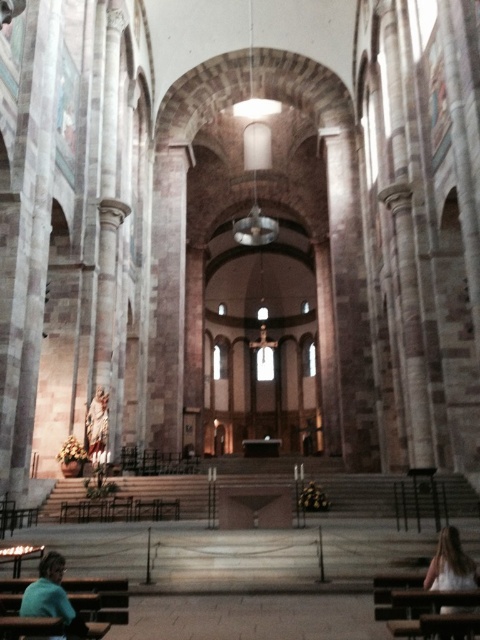
You are a photographer standing in the cathedral and want to capture both the blonde hair at lower right and the matte stone statue at center in the same frame. Which object should you focus on first to ensure both are in focus?

The matte stone statue at center is smaller than the blonde hair at lower right, so you should focus on the matte stone statue at center first to ensure both are in focus.

You are standing at the entrance of the church and see the teal fabric shirt at lower left and the matte stone statue at center. Which object is closer to the entrance?

The teal fabric shirt at lower left is closer to the entrance because it is positioned on the right side of the matte stone statue at center, which is further away from the entrance.